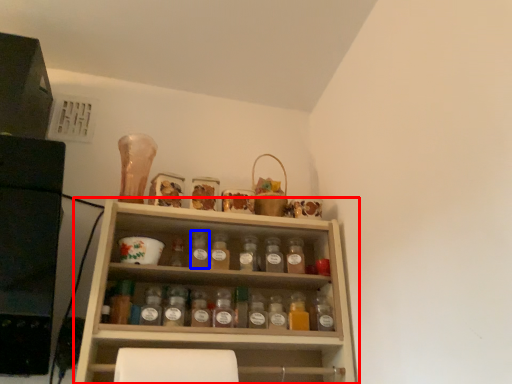
Question: Which object is further to the camera taking this photo, shelf (highlighted by a red box) or bottle (highlighted by a blue box)?

Choices:
 (A) shelf
 (B) bottle

Answer: (B)